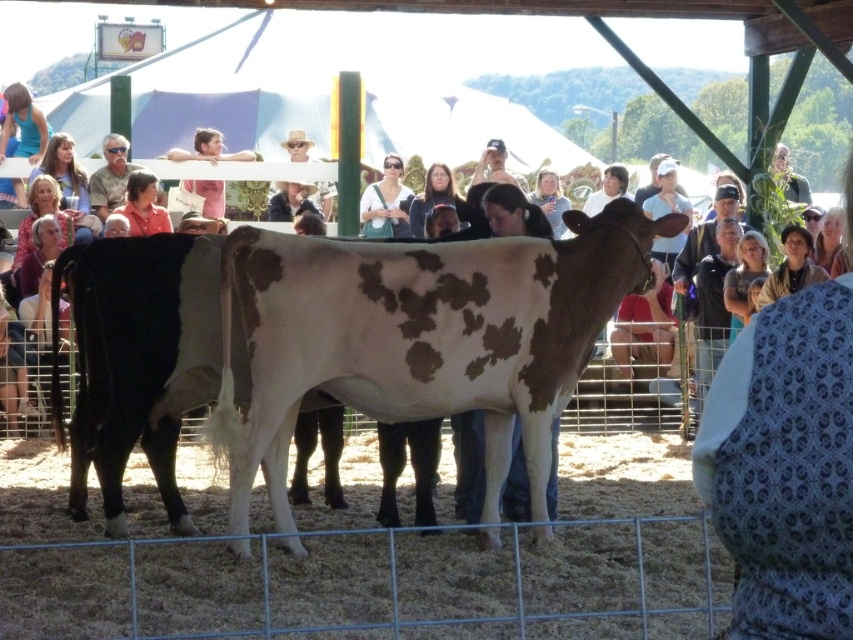
Does white spotted fur at center have a smaller size compared to matte white shirt at center?

Actually, white spotted fur at center might be larger than matte white shirt at center.

Is point (503, 342) positioned after point (381, 211)?

No, (503, 342) is in front of (381, 211).

Locate an element on the screen. The height and width of the screenshot is (640, 853). white spotted fur at center is located at coordinates (418, 339).

Who is higher up, speckled white cow at center or smooth skin face at upper center?

smooth skin face at upper center is above.

Is speckled white cow at center positioned behind smooth skin face at upper center?

Answer: No, it is in front of smooth skin face at upper center.

Between point (71, 417) and point (216, 131), which one is positioned in front?

Point (71, 417) is in front.

Locate an element on the screen. Image resolution: width=853 pixels, height=640 pixels. speckled white cow at center is located at coordinates (138, 356).

How distant is white spotted fur at center from smooth skin face at upper center?

white spotted fur at center is 9.09 meters from smooth skin face at upper center.

Does white spotted fur at center appear over smooth skin face at upper center?

No.

Identify the location of white spotted fur at center. Image resolution: width=853 pixels, height=640 pixels. (418, 339).

Find the location of `white spotted fur at center`. white spotted fur at center is located at coordinates (418, 339).